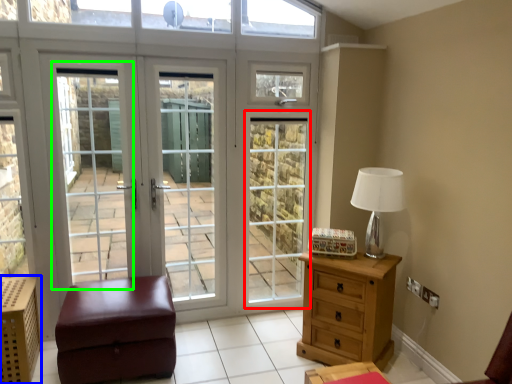
Question: Estimate the real-world distances between objects in this image. Which object is farther from screen door (highlighted by a red box), crate (highlighted by a blue box) or screen door (highlighted by a green box)?

Choices:
 (A) crate
 (B) screen door

Answer: (A)